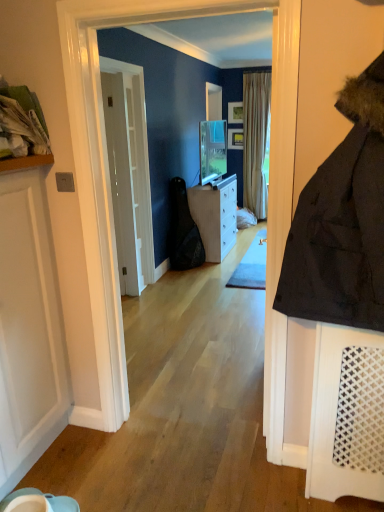
Question: Considering the positions of white matte door at left, the 1th door viewed from the front, and white fabric laundry at upper left in the image, is white matte door at left, the 1th door viewed from the front, wider or thinner than white fabric laundry at upper left?

Choices:
 (A) thin
 (B) wide

Answer: (A)

Question: From the image's perspective, relative to white fabric laundry at upper left, is white matte door at left, marked as the 2th door in a back-to-front arrangement, above or below?

Choices:
 (A) above
 (B) below

Answer: (B)

Question: Considering the real-world distances, which object is farthest from the white matte door at left, marked as the 2th door in a back-to-front arrangement?

Choices:
 (A) white fabric laundry at upper left
 (B) white glossy door at center, the second door viewed from the front
 (C) striped fabric curtain at center
 (D) white glossy cabinet at center

Answer: (C)

Question: Which object is positioned closest to the white glossy cabinet at center?

Choices:
 (A) white glossy door at center, the first door when ordered from back to front
 (B) white fabric laundry at upper left
 (C) striped fabric curtain at center
 (D) white matte door at left, marked as the 2th door in a back-to-front arrangement

Answer: (A)